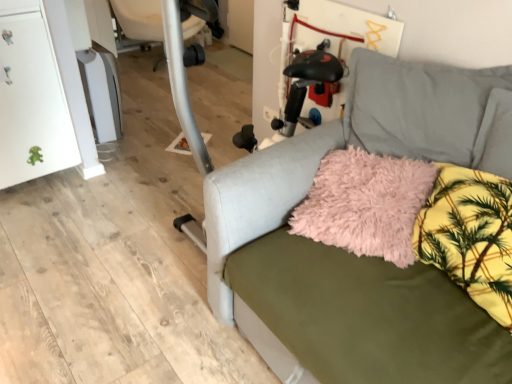
Measure the distance between yellow floral fabric pillow at lower right and camera.

yellow floral fabric pillow at lower right and camera are 1.08 meters apart.

Locate an element on the screen. The image size is (512, 384). white plastic swivel chair at upper left is located at coordinates pos(139,19).

You are a GUI agent. You are given a task and a screenshot of the screen. Output one action in this format:
    pyautogui.click(x=<x>, y=<y>)
    Task: Click on the matte gray couch at center
    
    Given the screenshot: What is the action you would take?
    pyautogui.click(x=364, y=257)

In the image, is yellow floral fabric pillow at lower right positioned in front of or behind matte gray couch at center?

yellow floral fabric pillow at lower right is behind matte gray couch at center.

Is there a large distance between yellow floral fabric pillow at lower right and matte gray couch at center?

Actually, yellow floral fabric pillow at lower right and matte gray couch at center are a little close together.

Which is more to the left, yellow floral fabric pillow at lower right or matte gray couch at center?

matte gray couch at center.

Would you consider yellow floral fabric pillow at lower right to be distant from white plastic swivel chair at upper left?

Yes.

How much distance is there between yellow floral fabric pillow at lower right and white plastic swivel chair at upper left?

9.75 feet.

Is white plastic swivel chair at upper left at the back of yellow floral fabric pillow at lower right?

No, yellow floral fabric pillow at lower right is not facing the opposite direction of white plastic swivel chair at upper left.

Would you say yellow floral fabric pillow at lower right contains white plastic swivel chair at upper left?

No, white plastic swivel chair at upper left is not inside yellow floral fabric pillow at lower right.

From a real-world perspective, between fluffy pink pillow at center and matte gray couch at center, who is vertically lower?

matte gray couch at center.

Could you tell me if fluffy pink pillow at center is facing matte gray couch at center?

Yes.

Can you confirm if fluffy pink pillow at center is smaller than matte gray couch at center?

Yes.

Does yellow floral fabric pillow at lower right have a greater width compared to fluffy pink pillow at center?

No, yellow floral fabric pillow at lower right is not wider than fluffy pink pillow at center.

Considering the relative sizes of yellow floral fabric pillow at lower right and fluffy pink pillow at center in the image provided, is yellow floral fabric pillow at lower right bigger than fluffy pink pillow at center?

No, yellow floral fabric pillow at lower right is not bigger than fluffy pink pillow at center.

Consider the image. Considering the relative positions of yellow floral fabric pillow at lower right and fluffy pink pillow at center in the image provided, is yellow floral fabric pillow at lower right to the right of fluffy pink pillow at center from the viewer's perspective?

Yes, yellow floral fabric pillow at lower right is to the right of fluffy pink pillow at center.

Is yellow floral fabric pillow at lower right inside or outside of fluffy pink pillow at center?

yellow floral fabric pillow at lower right lies outside fluffy pink pillow at center.

Is matte gray couch at center aimed at fluffy pink pillow at center?

Yes.

From the image's perspective, is matte gray couch at center beneath fluffy pink pillow at center?

Yes.

Are matte gray couch at center and fluffy pink pillow at center making contact?

There is a gap between matte gray couch at center and fluffy pink pillow at center.

Could you tell me if fluffy pink pillow at center is turned towards yellow floral fabric pillow at lower right?

No, fluffy pink pillow at center is not facing towards yellow floral fabric pillow at lower right.

From a real-world perspective, between fluffy pink pillow at center and yellow floral fabric pillow at lower right, who is vertically higher?

yellow floral fabric pillow at lower right.

Is yellow floral fabric pillow at lower right completely or partially inside fluffy pink pillow at center?

Actually, yellow floral fabric pillow at lower right is outside fluffy pink pillow at center.

Is matte gray couch at center at the right side of white plastic swivel chair at upper left?

Indeed, matte gray couch at center is positioned on the right side of white plastic swivel chair at upper left.

Between matte gray couch at center and white plastic swivel chair at upper left, which one has less height?

With less height is white plastic swivel chair at upper left.

Based on the photo, considering their positions, is matte gray couch at center located in front of or behind white plastic swivel chair at upper left?

Clearly, matte gray couch at center is in front of white plastic swivel chair at upper left.

Locate an element on the screen. studio couch that appears in front of the white plastic swivel chair at upper left is located at coordinates (364, 257).

The width and height of the screenshot is (512, 384). Find the location of `studio couch on the left of the yellow floral fabric pillow at lower right`. studio couch on the left of the yellow floral fabric pillow at lower right is located at coordinates point(364,257).

This screenshot has height=384, width=512. In the image, there is a white plastic swivel chair at upper left. What are the coordinates of `pillow below it (from the image's perspective)` in the screenshot? It's located at (470, 236).

From the image, which object appears to be nearer to matte gray couch at center, yellow floral fabric pillow at lower right or white plastic swivel chair at upper left?

Based on the image, yellow floral fabric pillow at lower right appears to be nearer to matte gray couch at center.

Based on their spatial positions, is white plastic swivel chair at upper left or fluffy pink pillow at center further from yellow floral fabric pillow at lower right?

white plastic swivel chair at upper left.

Based on their spatial positions, is matte gray couch at center or yellow floral fabric pillow at lower right further from fluffy pink pillow at center?

Among the two, yellow floral fabric pillow at lower right is located further to fluffy pink pillow at center.

When comparing their distances from white plastic swivel chair at upper left, does fluffy pink pillow at center or yellow floral fabric pillow at lower right seem further?

The object further to white plastic swivel chair at upper left is yellow floral fabric pillow at lower right.

Which object lies nearer to the anchor point matte gray couch at center, white plastic swivel chair at upper left or fluffy pink pillow at center?

fluffy pink pillow at center is positioned closer to the anchor matte gray couch at center.

Based on their spatial positions, is white plastic swivel chair at upper left or yellow floral fabric pillow at lower right further from matte gray couch at center?

white plastic swivel chair at upper left lies further to matte gray couch at center than the other object.

From the image, which object appears to be farther from yellow floral fabric pillow at lower right, fluffy pink pillow at center or white plastic swivel chair at upper left?

white plastic swivel chair at upper left lies further to yellow floral fabric pillow at lower right than the other object.

Looking at the image, which one is located closer to white plastic swivel chair at upper left, matte gray couch at center or fluffy pink pillow at center?

matte gray couch at center is positioned closer to the anchor white plastic swivel chair at upper left.

Locate an element on the screen. pillow between matte gray couch at center and fluffy pink pillow at center along the z-axis is located at coordinates (470, 236).

At what (x,y) coordinates should I click in order to perform the action: click on throw pillow between yellow floral fabric pillow at lower right and white plastic swivel chair at upper left in the front-back direction. Please return your answer as a coordinate pair (x, y). The width and height of the screenshot is (512, 384). Looking at the image, I should click on (365, 204).

Image resolution: width=512 pixels, height=384 pixels. Find the location of `throw pillow positioned between matte gray couch at center and white plastic swivel chair at upper left from near to far`. throw pillow positioned between matte gray couch at center and white plastic swivel chair at upper left from near to far is located at coordinates (365, 204).

Locate an element on the screen. pillow located between matte gray couch at center and white plastic swivel chair at upper left in the depth direction is located at coordinates (470, 236).